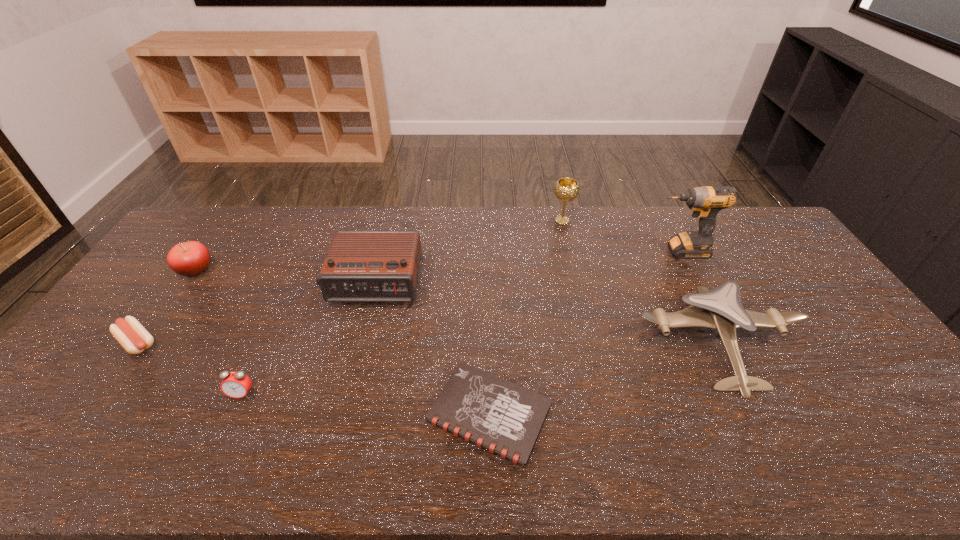
Where is `vacant space that satisfies the following two spatial constraints: 1. on the front panel of the notebook; 2. on the right side of the radio receiver`? The width and height of the screenshot is (960, 540). vacant space that satisfies the following two spatial constraints: 1. on the front panel of the notebook; 2. on the right side of the radio receiver is located at coordinates (341, 414).

What are the coordinates of `free region that satisfies the following two spatial constraints: 1. on the front panel of the fourth object from right to left; 2. on the right side of the radio receiver` in the screenshot? It's located at (341, 414).